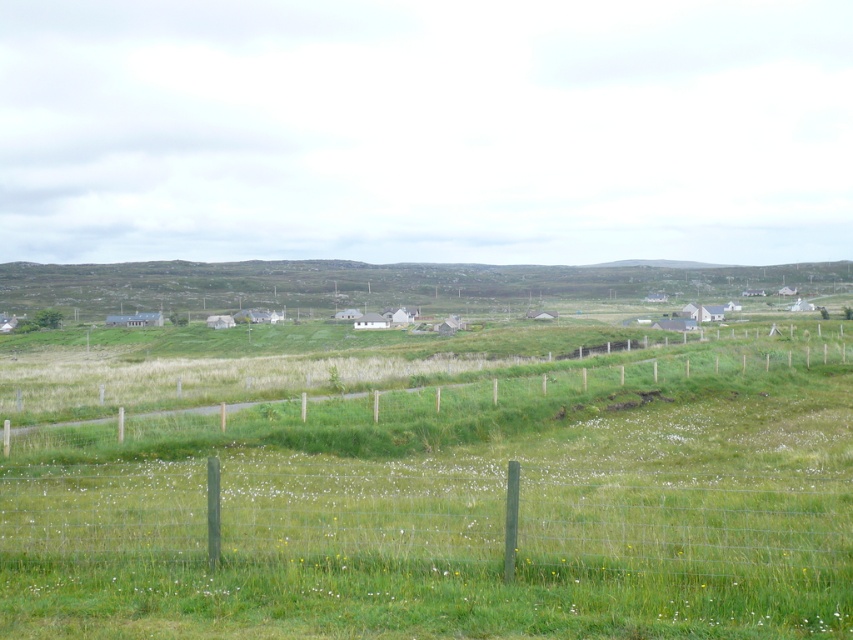
Can you confirm if green wire fence at lower center is taller than green wooden fence at center?

No, green wire fence at lower center is not taller than green wooden fence at center.

Identify the location of green wire fence at lower center. (425, 516).

Locate an element on the screen. The height and width of the screenshot is (640, 853). green wire fence at lower center is located at coordinates (425, 516).